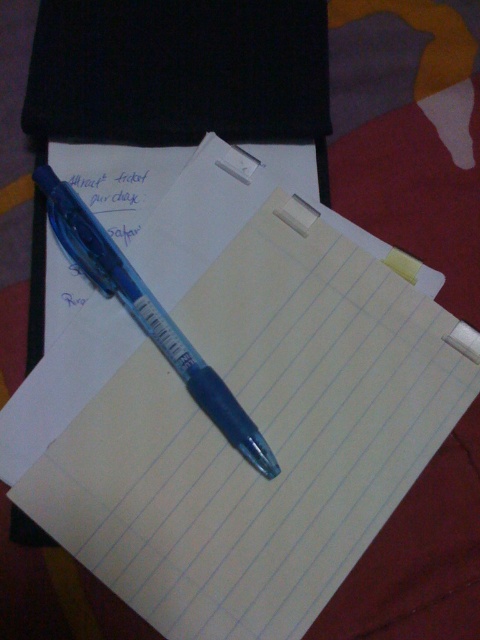
Between white paper at center and yellow paper at upper center, which one is positioned higher?

white paper at center

You are a GUI agent. You are given a task and a screenshot of the screen. Output one action in this format:
    pyautogui.click(x=<x>, y=<y>)
    Task: Click on the white paper at center
    
    Given the screenshot: What is the action you would take?
    pyautogui.click(x=299, y=212)

Does transparent plastic pen at center have a smaller size compared to yellow paper at upper center?

No, transparent plastic pen at center is not smaller than yellow paper at upper center.

Does transparent plastic pen at center appear under yellow paper at upper center?

Yes.

Is point (87, 228) farther from camera compared to point (386, 256)?

Yes, point (87, 228) is behind point (386, 256).

The width and height of the screenshot is (480, 640). In order to click on transparent plastic pen at center in this screenshot , I will do `click(148, 316)`.

Does transparent plastic pen at center appear on the right side of white paper at center?

Incorrect, transparent plastic pen at center is not on the right side of white paper at center.

What do you see at coordinates (148, 316) in the screenshot? This screenshot has height=640, width=480. I see `transparent plastic pen at center` at bounding box center [148, 316].

Who is more forward, (75, 208) or (295, 205)?

Point (75, 208) is in front.

Find the location of a particular element. The height and width of the screenshot is (640, 480). transparent plastic pen at center is located at coordinates (148, 316).